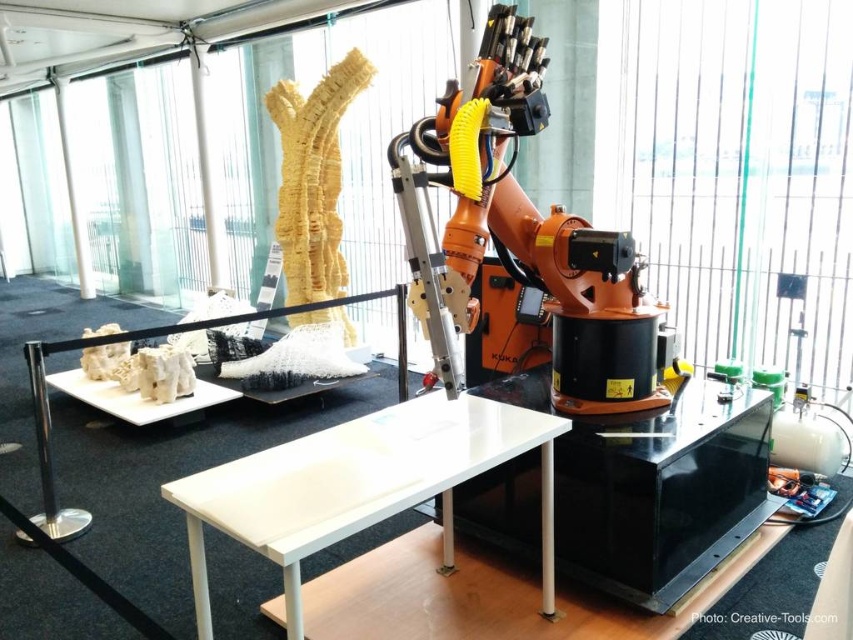
Question: Is black glossy table at center below white glossy table at center?

Choices:
 (A) yes
 (B) no

Answer: (B)

Question: Can you confirm if black glossy table at center is wider than white glossy table at center?

Choices:
 (A) yes
 (B) no

Answer: (A)

Question: Which point is closer to the camera taking this photo?

Choices:
 (A) (281, 472)
 (B) (722, 513)

Answer: (A)

Question: Is black glossy table at center bigger than white glossy table at center?

Choices:
 (A) yes
 (B) no

Answer: (A)

Question: Which point is closer to the camera?

Choices:
 (A) black glossy table at center
 (B) white glossy table at center

Answer: (B)